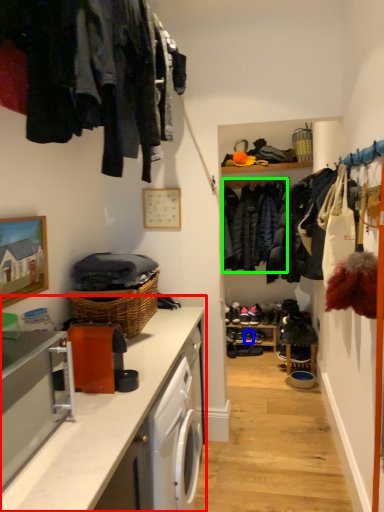
Question: Which object is the closest to the countertop (highlighted by a red box)? Choose among these: shoe (highlighted by a blue box) or clothing (highlighted by a green box).

Choices:
 (A) shoe
 (B) clothing

Answer: (B)